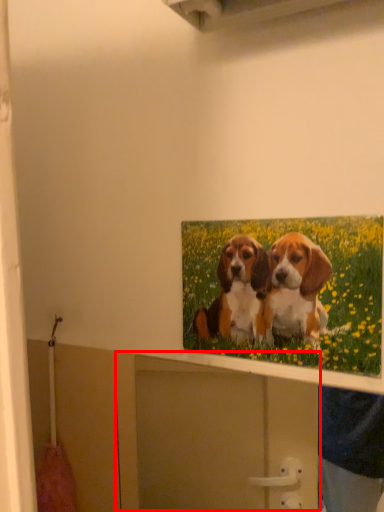
Question: From the image's perspective, where is cabinet (annotated by the red box) located in relation to picture frame in the image?

Choices:
 (A) above
 (B) below

Answer: (B)